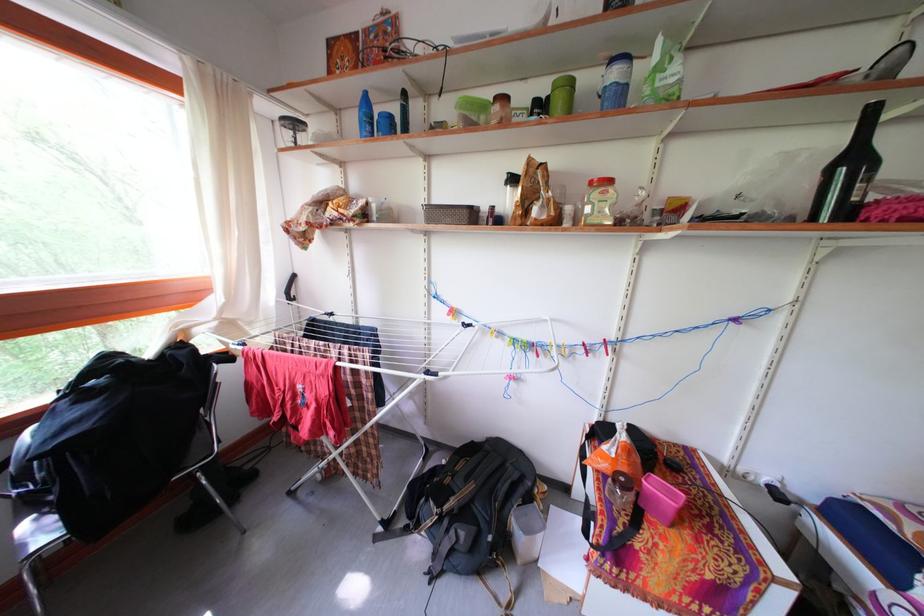
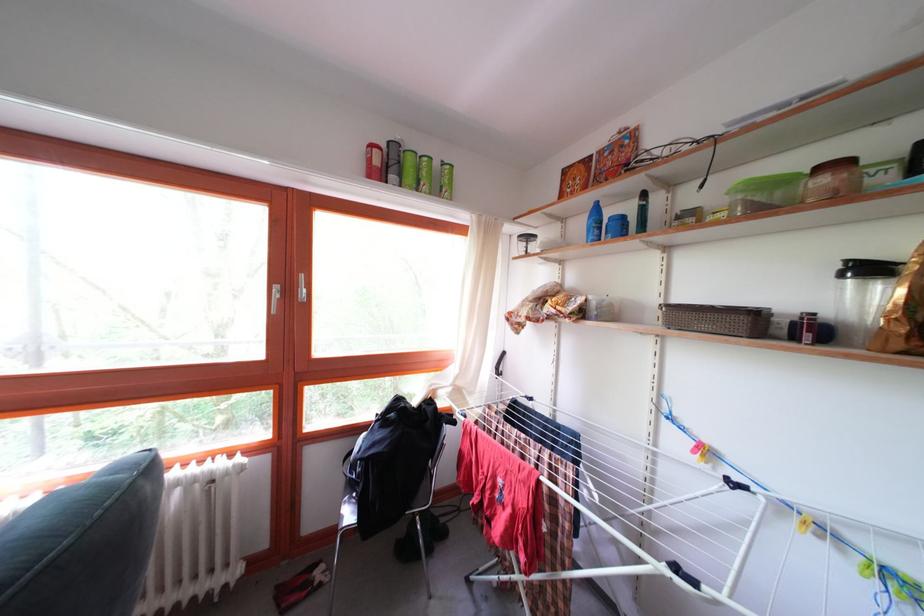
In the second image, find the point that corresponds to pixel 505 114 in the first image.

(832, 187)